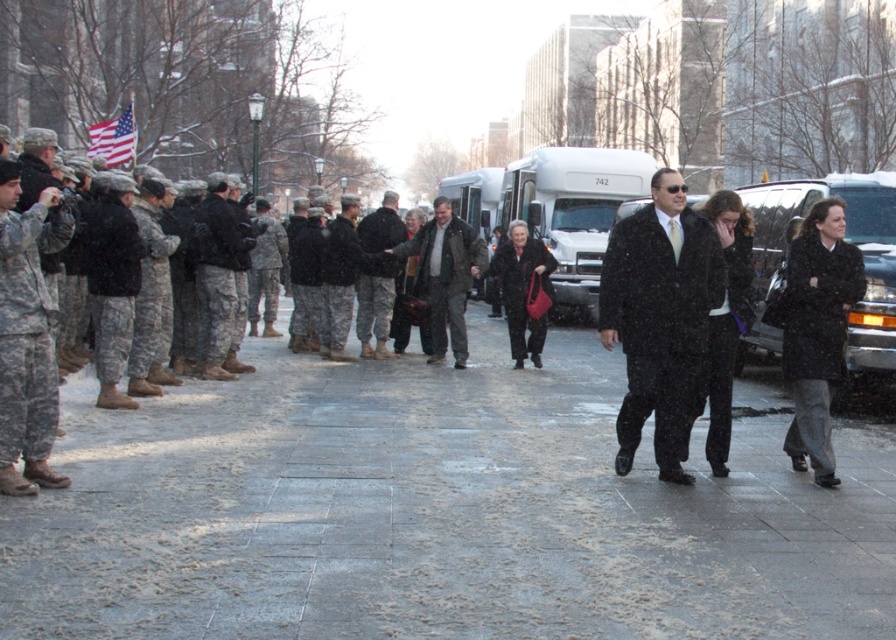
Measure the distance between black wool coat at center and dark brown leather jacket at center.

The distance of black wool coat at center from dark brown leather jacket at center is 20.27 feet.

At what (x,y) coordinates should I click in order to perform the action: click on black wool coat at center. Please return your answer as a coordinate pair (x, y). Image resolution: width=896 pixels, height=640 pixels. Looking at the image, I should click on (659, 317).

Is point (685, 369) farther from viewer compared to point (409, 253)?

No.

I want to click on black wool coat at center, so click(x=659, y=317).

Is gray concrete sidewalk at center below camouflage uniform at left?

Yes.

This screenshot has height=640, width=896. Identify the location of gray concrete sidewalk at center. (438, 512).

Which is above, camouflage uniform at center or american flag at upper left?

Positioned higher is american flag at upper left.

Can you confirm if camouflage uniform at center is positioned below american flag at upper left?

Yes.

Identify the location of camouflage uniform at center. (341, 276).